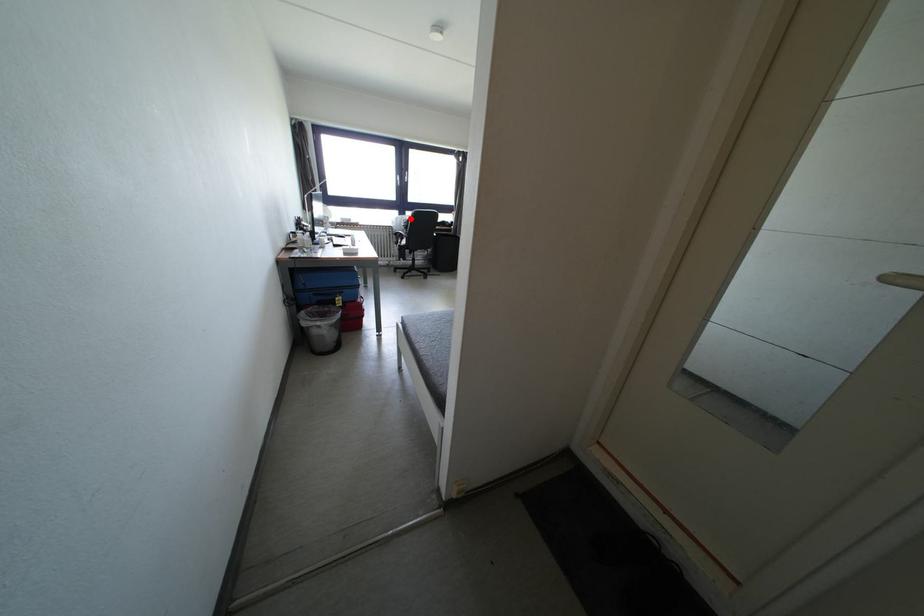
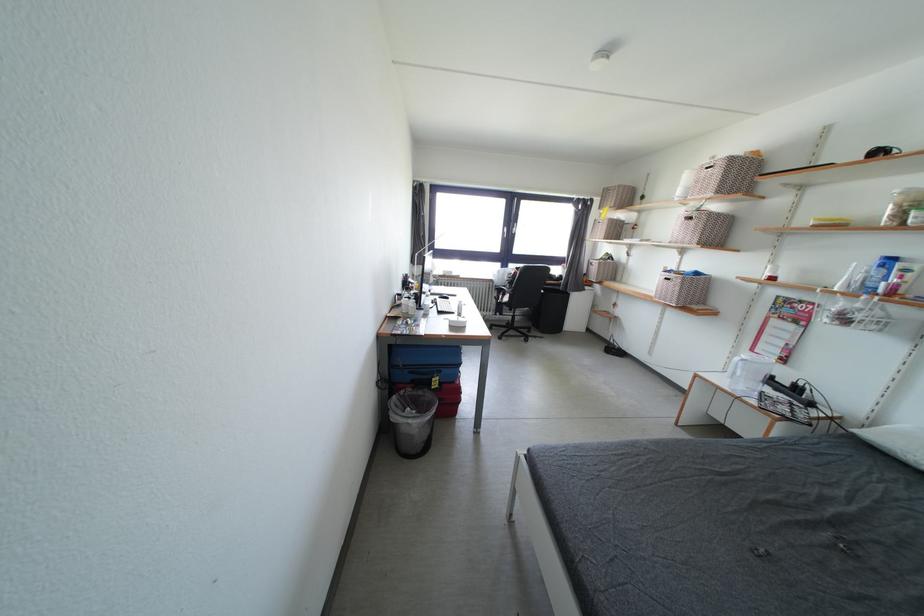
Question: A red point is marked in image1. In image2, is the corresponding 3D point closer to the camera or farther? Reply with the corresponding letter.

Choices:
 (A) The corresponding 3D point is closer.
 (B) The corresponding 3D point is farther.

Answer: (B)